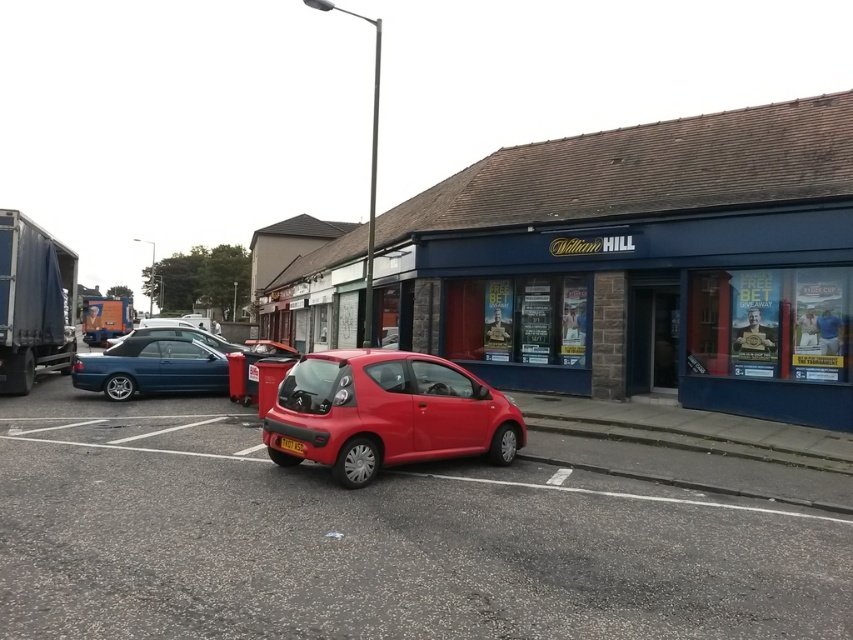
Question: Which of the following is the closest to the observer?

Choices:
 (A) 281,440
 (B) 495,432
 (C) 619,538

Answer: (C)

Question: Can you confirm if blue tarpaulin trailer truck at left is positioned to the left of yellow plastic license plate at center?

Choices:
 (A) no
 (B) yes

Answer: (B)

Question: Does blue tarpaulin trailer truck at left appear over metallic blue convertible at center-left?

Choices:
 (A) yes
 (B) no

Answer: (A)

Question: Does orange cardboard trailer truck at left have a greater width compared to yellow plastic license plate at center?

Choices:
 (A) no
 (B) yes

Answer: (B)

Question: Based on their relative distances, which object is farther from the metallic blue convertible at center-left?

Choices:
 (A) yellow plastic license plate at center
 (B) blue tarpaulin trailer truck at left
 (C) metallic red car at center
 (D) orange cardboard trailer truck at left

Answer: (D)

Question: Which of the following is the farthest from the observer?

Choices:
 (A) metallic blue sedan at center-left
 (B) metallic blue convertible at center-left

Answer: (A)